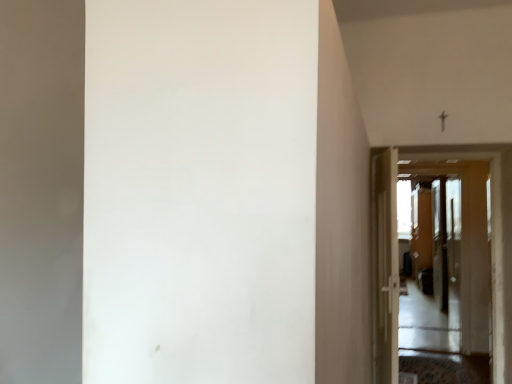
Question: Is point (454, 225) positioned closer to the camera than point (379, 236)?

Choices:
 (A) closer
 (B) farther

Answer: (B)

Question: Considering the positions of white glossy door at center, the second door positioned from the left, and white glossy door at right, the 1th door viewed from the left, in the image, is white glossy door at center, the second door positioned from the left, taller or shorter than white glossy door at right, the 1th door viewed from the left,?

Choices:
 (A) tall
 (B) short

Answer: (A)

Question: Which of these objects is positioned farthest from the white glossy door at right, the 2th door in the right-to-left sequence?

Choices:
 (A) white glossy door at center, marked as the first door in a right-to-left arrangement
 (B) transparent glass screen door at center, which is the 1th screen door from front to back
 (C) transparent plastic screen door at right, which is the first screen door from back to front

Answer: (C)

Question: Which object is the farthest from the white glossy door at right, the 2th door in the right-to-left sequence?

Choices:
 (A) white glossy door at center, the second door positioned from the left
 (B) transparent plastic screen door at right, which is the first screen door from back to front
 (C) transparent glass screen door at center, positioned as the 2th screen door in back-to-front order

Answer: (B)